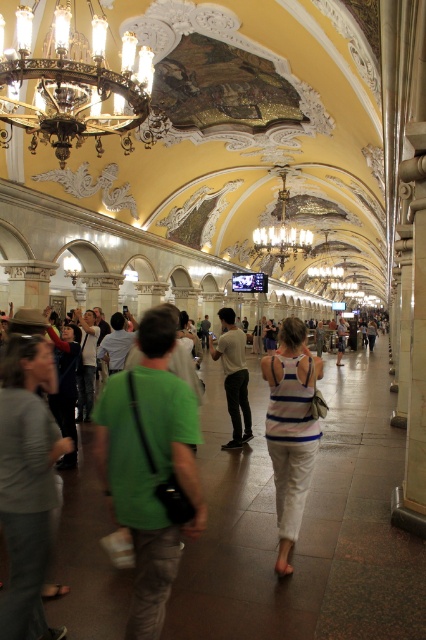
Does white cotton shirt at center have a greater height compared to gold metallic chandelier at center?

No, white cotton shirt at center is not taller than gold metallic chandelier at center.

The width and height of the screenshot is (426, 640). What do you see at coordinates (233, 376) in the screenshot? I see `white cotton shirt at center` at bounding box center [233, 376].

What do you see at coordinates (233, 376) in the screenshot? I see `white cotton shirt at center` at bounding box center [233, 376].

Where is `white cotton shirt at center`? white cotton shirt at center is located at coordinates (233, 376).

Does green fabric shirt at center come behind white cotton tank top at center?

No, green fabric shirt at center is in front of white cotton tank top at center.

Is green fabric shirt at center below white cotton tank top at center?

Incorrect, green fabric shirt at center is not positioned below white cotton tank top at center.

Who is more distant from viewer, (x=164, y=550) or (x=307, y=474)?

Point (x=307, y=474)

This screenshot has width=426, height=640. I want to click on green fabric shirt at center, so click(149, 467).

Based on the photo, is white cotton tank top at center above white cotton shirt at center?

Actually, white cotton tank top at center is below white cotton shirt at center.

Can you confirm if white cotton tank top at center is positioned to the left of white cotton shirt at center?

Incorrect, white cotton tank top at center is not on the left side of white cotton shirt at center.

Image resolution: width=426 pixels, height=640 pixels. Find the location of `white cotton tank top at center`. white cotton tank top at center is located at coordinates (290, 429).